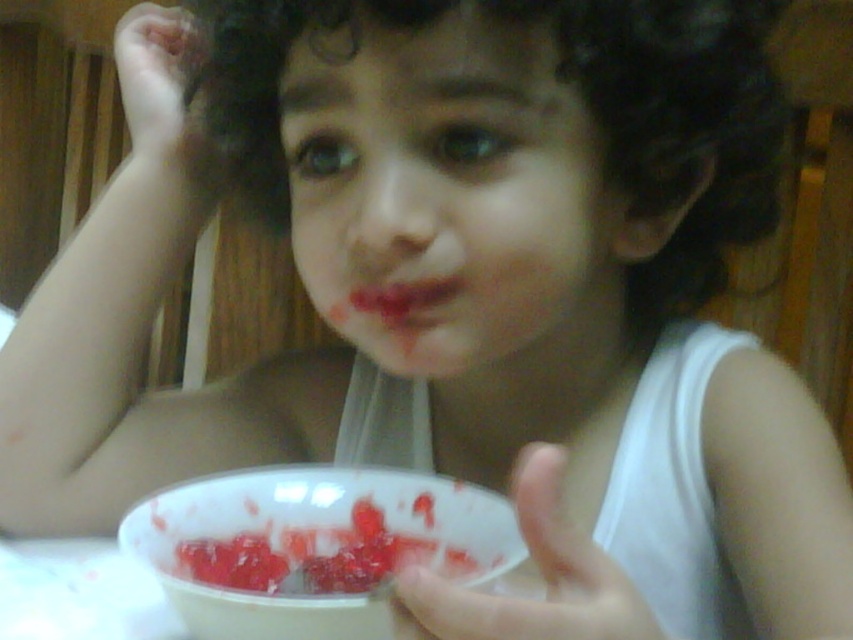
The child has a smooth skin face at center and a white plastic bowl at lower center. Which object is more to the right?

The smooth skin face at center is positioned on the right side of the white plastic bowl at lower center, so the smooth skin face at center is more to the right.

You are a parent trying to clean up the dining area after your child had a snack. You have two bowls in front of you, the white plastic bowl at lower center and the slightly glossy plastic bowl at lower center. Which bowl should you choose to store leftovers in if you want the one that is wider?

The white plastic bowl at lower center is wider than the slightly glossy plastic bowl at lower center, so you should choose the white plastic bowl at lower center to store leftovers in if you want the wider one.

You are a photographer trying to capture a closeup shot of the child in the image. You need to adjust your camera position to ensure the subject is in focus. Given the distance between the camera and the point at coordinates point (549, 273), what is the minimum distance you should maintain to achieve sharp focus?

The minimum distance to maintain for sharp focus is 16.21 inches, as that is the distance between the camera and the point (549, 273).